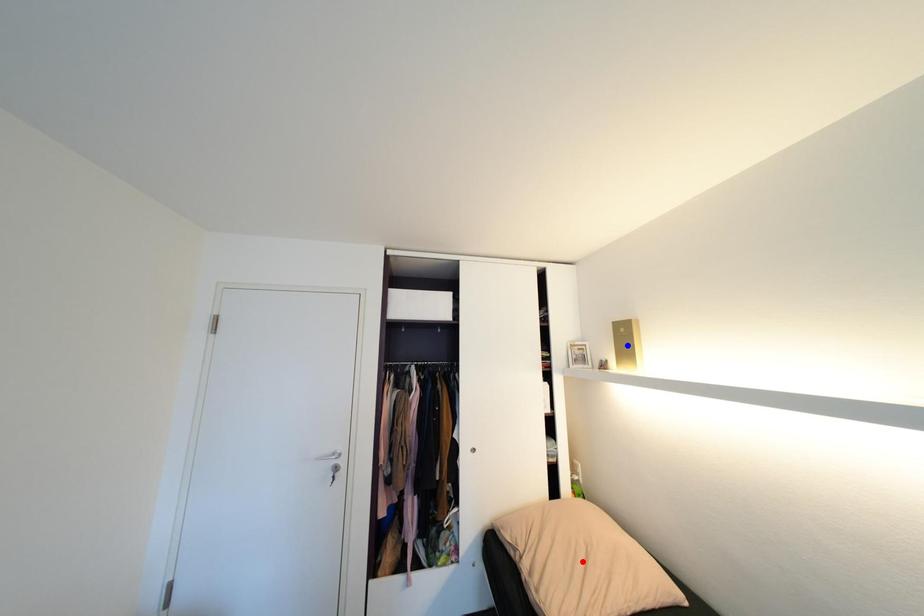
Question: In the image, two points are highlighted. Which point is nearer to the camera? Reply with the corresponding letter.

Choices:
 (A) blue point
 (B) red point

Answer: (B)